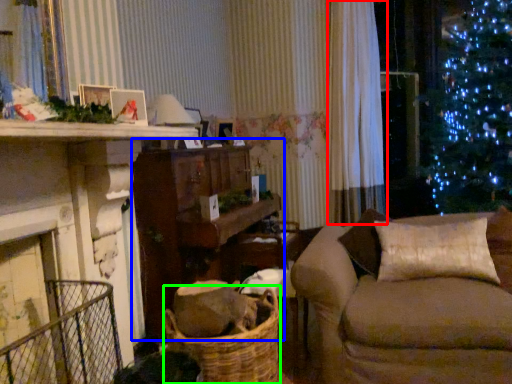
Question: Which object is the farthest from curtain (highlighted by a red box)? Choose among these: table (highlighted by a blue box) or basket (highlighted by a green box).

Choices:
 (A) table
 (B) basket

Answer: (B)